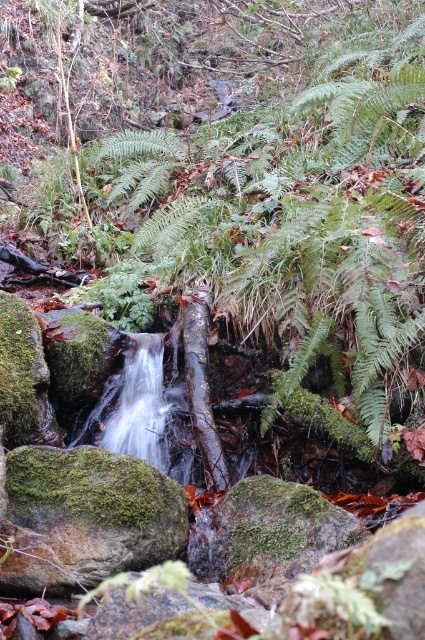
You are standing at the edge of the stream and want to cross to the other side. You see the green mossy rock at lower left and the clear water at center. Which object is closer to your current position?

The green mossy rock at lower left is closer to your current position because it is positioned to the left of the clear water at center, which is further away.

You are standing at the edge of the stream and see the point marked as point (269, 531). What is the nearest object to this point?

The nearest object to point (269, 531) is the green mossy rock at center.